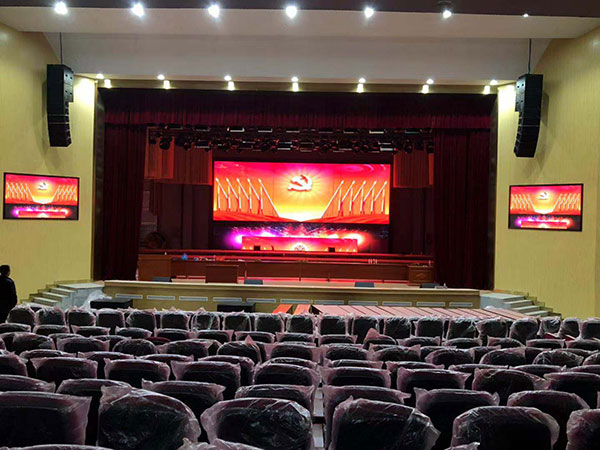
Locate an element on the screen. This screenshot has width=600, height=450. speakers is located at coordinates (57, 81), (537, 101), (255, 277), (167, 279), (364, 285), (431, 289).